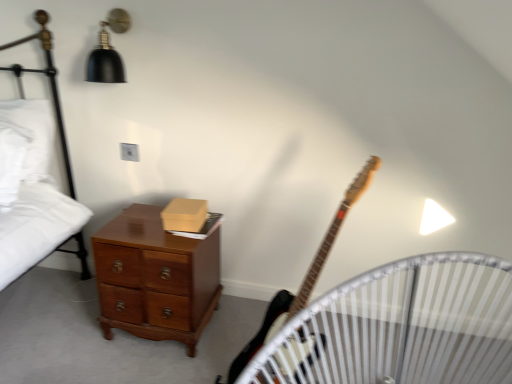
Describe the element at coordinates (50, 86) in the screenshot. I see `white cotton bed at left` at that location.

What is the approximate height of wooden electric guitar at center-right?

It is 37.95 inches.

Describe the element at coordinates (400, 327) in the screenshot. Image resolution: width=512 pixels, height=384 pixels. I see `wooden crib at lower left` at that location.

At what (x,y) coordinates should I click in order to perform the action: click on matte brown box at center. Please return your answer as a coordinate pair (x, y). The height and width of the screenshot is (384, 512). Looking at the image, I should click on (185, 215).

Measure the distance between black matte lampshade at upper left and camera.

black matte lampshade at upper left and camera are 5.51 feet apart from each other.

Where is `mahogany wooden chest of drawers at lower left`? This screenshot has height=384, width=512. mahogany wooden chest of drawers at lower left is located at coordinates (155, 278).

Locate an element on the screen. This screenshot has width=512, height=384. pillow on the left of matte brown box at center is located at coordinates (23, 145).

Consider the image. Which of these two, white soft pillow at left or matte brown box at center, stands shorter?

With less height is matte brown box at center.

Between white soft pillow at left and matte brown box at center, which one has larger width?

white soft pillow at left.

Is white soft pillow at left not near matte brown box at center?

white soft pillow at left is actually quite close to matte brown box at center.

Find the location of a particular element. light fixture on the right of white soft pillow at left is located at coordinates (108, 51).

Considering the sizes of objects white soft pillow at left and black matte lampshade at upper left in the image provided, who is taller, white soft pillow at left or black matte lampshade at upper left?

Standing taller between the two is white soft pillow at left.

Based on the photo, from the image's perspective, who appears lower, white soft pillow at left or black matte lampshade at upper left?

white soft pillow at left.

Between black matte lampshade at upper left and mahogany wooden chest of drawers at lower left, which one has larger width?

Wider between the two is mahogany wooden chest of drawers at lower left.

In terms of size, does black matte lampshade at upper left appear bigger or smaller than mahogany wooden chest of drawers at lower left?

Clearly, black matte lampshade at upper left is smaller in size than mahogany wooden chest of drawers at lower left.

Is mahogany wooden chest of drawers at lower left inside black matte lampshade at upper left?

No.

Where is `light fixture above the mahogany wooden chest of drawers at lower left (from a real-world perspective)`? This screenshot has height=384, width=512. light fixture above the mahogany wooden chest of drawers at lower left (from a real-world perspective) is located at coordinates (108, 51).

Could you tell me if white soft pillow at left is turned towards mahogany wooden chest of drawers at lower left?

No, white soft pillow at left is not aimed at mahogany wooden chest of drawers at lower left.

Looking at this image, which is behind, white soft pillow at left or mahogany wooden chest of drawers at lower left?

white soft pillow at left is further away from the camera.

Who is bigger, white soft pillow at left or mahogany wooden chest of drawers at lower left?

mahogany wooden chest of drawers at lower left.

Which of these two, matte brown box at center or wooden crib at lower left, is bigger?

With larger size is wooden crib at lower left.

From a real-world perspective, is matte brown box at center under wooden crib at lower left?

Incorrect, from a real-world perspective, matte brown box at center is higher than wooden crib at lower left.

Is matte brown box at center wider than wooden crib at lower left?

No, matte brown box at center is not wider than wooden crib at lower left.

Measure the distance between matte brown box at center and wooden crib at lower left.

A distance of 29.86 inches exists between matte brown box at center and wooden crib at lower left.

Is black matte lampshade at upper left positioned with its back to wooden electric guitar at center-right?

No, wooden electric guitar at center-right is not at the back of black matte lampshade at upper left.

Which is behind, black matte lampshade at upper left or wooden electric guitar at center-right?

black matte lampshade at upper left is more distant.

Is black matte lampshade at upper left touching wooden electric guitar at center-right?

black matte lampshade at upper left and wooden electric guitar at center-right are not in contact.

From the image's perspective, is black matte lampshade at upper left above or below white cotton bed at left?

Clearly, from the image's perspective, black matte lampshade at upper left is above white cotton bed at left.

Is black matte lampshade at upper left positioned before white cotton bed at left?

No, black matte lampshade at upper left is further to the viewer.

Where is `bed located below the black matte lampshade at upper left (from the image's perspective)`? Image resolution: width=512 pixels, height=384 pixels. bed located below the black matte lampshade at upper left (from the image's perspective) is located at coordinates (50, 86).

What are the coordinates of `pillow located behind the matte brown box at center` in the screenshot? It's located at (23, 145).

This screenshot has height=384, width=512. What are the coordinates of `pillow to the left of black matte lampshade at upper left` in the screenshot? It's located at (23, 145).

Looking at the image, which one is located closer to mahogany wooden chest of drawers at lower left, white soft pillow at left or matte brown box at center?

matte brown box at center lies closer to mahogany wooden chest of drawers at lower left than the other object.

Based on their spatial positions, is black matte lampshade at upper left or matte brown box at center further from mahogany wooden chest of drawers at lower left?

The object further to mahogany wooden chest of drawers at lower left is black matte lampshade at upper left.

When comparing their distances from wooden crib at lower left, does black matte lampshade at upper left or wooden electric guitar at center-right seem further?

Among the two, black matte lampshade at upper left is located further to wooden crib at lower left.

When comparing their distances from wooden electric guitar at center-right, does matte brown box at center or wooden crib at lower left seem closer?

wooden crib at lower left is positioned closer to the anchor wooden electric guitar at center-right.

Looking at the image, which one is located closer to white cotton bed at left, wooden electric guitar at center-right or wooden crib at lower left?

wooden electric guitar at center-right.

Based on their spatial positions, is wooden crib at lower left or black matte lampshade at upper left further from white cotton bed at left?

wooden crib at lower left.

Considering their positions, is wooden electric guitar at center-right positioned further to white soft pillow at left than wooden crib at lower left?

wooden crib at lower left is positioned further to the anchor white soft pillow at left.

Looking at the image, which one is located closer to wooden electric guitar at center-right, black matte lampshade at upper left or wooden crib at lower left?

Based on the image, wooden crib at lower left appears to be nearer to wooden electric guitar at center-right.

At what (x,y) coordinates should I click in order to perform the action: click on guitar between white cotton bed at left and wooden crib at lower left from left to right. Please return your answer as a coordinate pair (x, y). Looking at the image, I should click on (304, 279).

Locate an element on the screen. bed between white soft pillow at left and matte brown box at center from left to right is located at coordinates (50, 86).

Where is `chest of drawers between white cotton bed at left and wooden crib at lower left from left to right`? The width and height of the screenshot is (512, 384). chest of drawers between white cotton bed at left and wooden crib at lower left from left to right is located at coordinates (155, 278).

Where is `box located between white cotton bed at left and wooden electric guitar at center-right in the left-right direction`? The height and width of the screenshot is (384, 512). box located between white cotton bed at left and wooden electric guitar at center-right in the left-right direction is located at coordinates (185, 215).